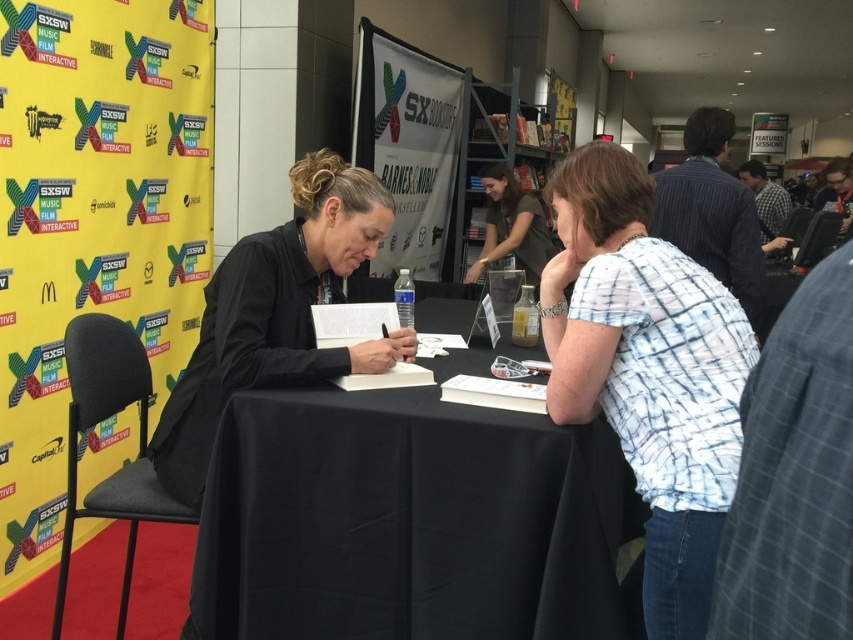
Question: Is dark corduroy blazer at upper right closer to the viewer compared to checkered shirt at right?

Choices:
 (A) no
 (B) yes

Answer: (B)

Question: Can you confirm if black fabric table at center is wider than dark brown shirt at center?

Choices:
 (A) yes
 (B) no

Answer: (A)

Question: Considering the real-world distances, which object is farthest from the black fabric table at center?

Choices:
 (A) black matte shirt at center
 (B) dark brown shirt at center
 (C) white tie-dye shirt at center

Answer: (B)

Question: Is white tie-dye shirt at center smaller than dark corduroy blazer at upper right?

Choices:
 (A) no
 (B) yes

Answer: (B)

Question: Which point appears farthest from the camera in this image?

Choices:
 (A) (770, 182)
 (B) (345, 609)

Answer: (A)

Question: Which point appears farthest from the camera in this image?

Choices:
 (A) (563, 390)
 (B) (254, 576)
 (C) (260, 280)

Answer: (C)